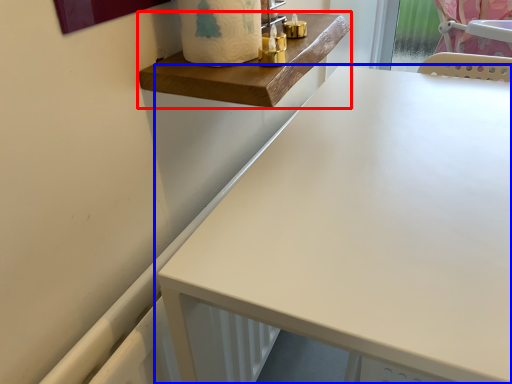
Question: Which object appears farthest to the camera in this image, changing table (highlighted by a red box) or table (highlighted by a blue box)?

Choices:
 (A) changing table
 (B) table

Answer: (A)